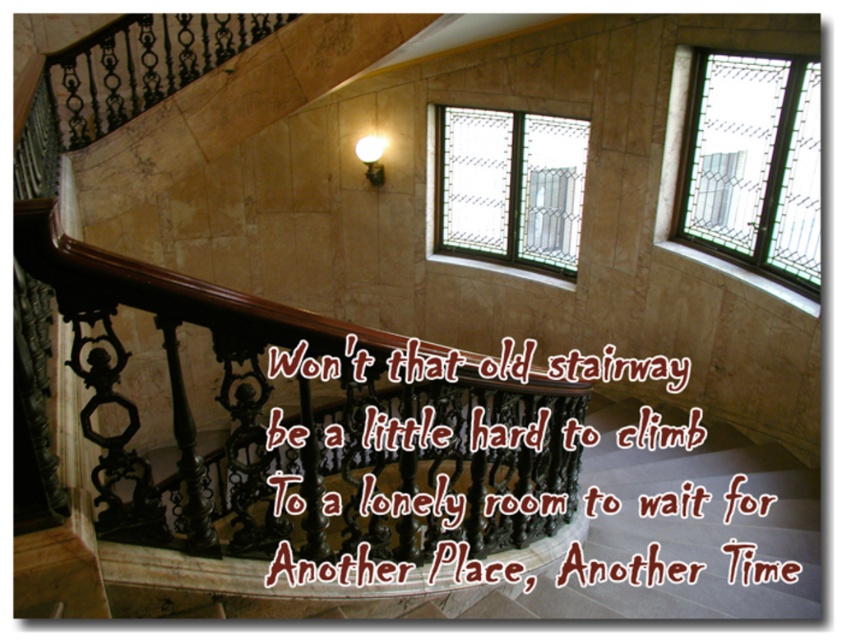
Looking at this image, you are an interior designer assessing the natural light in the staircase area. You notice two clear glass windows, the clear glass window at upper right and the clear glass window at center. Which window allows more light into the staircase area?

The clear glass window at center allows more light into the staircase area because it is wider than the clear glass window at upper right.